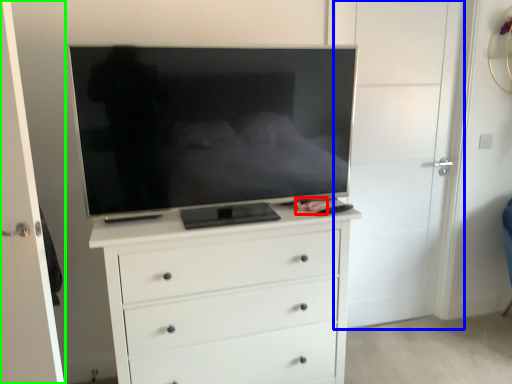
Question: Which object is the closest to the person (highlighted by a red box)? Choose among these: door (highlighted by a blue box) or door (highlighted by a green box).

Choices:
 (A) door
 (B) door

Answer: (A)